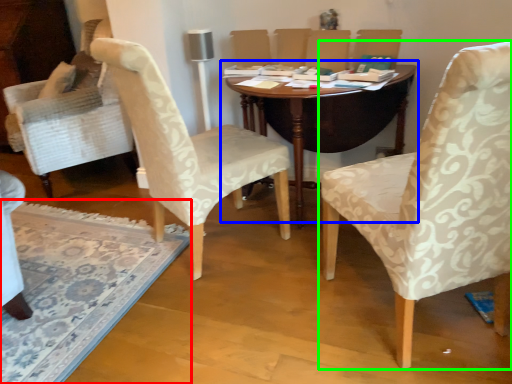
Question: Estimate the real-world distances between objects in this image. Which object is closer to mat (highlighted by a red box), table (highlighted by a blue box) or chair (highlighted by a green box)?

Choices:
 (A) table
 (B) chair

Answer: (A)